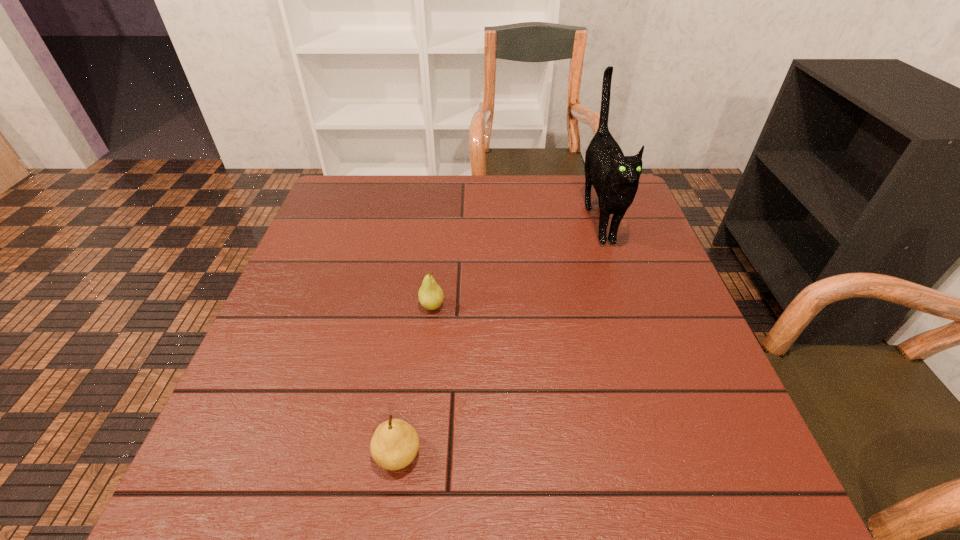
What are the coordinates of `free space in the image that satisfies the following two spatial constraints: 1. on the back side of the nearest object; 2. on the right side of the second nearest object` in the screenshot? It's located at (419, 306).

This screenshot has width=960, height=540. I want to click on free space that satisfies the following two spatial constraints: 1. on the back side of the nearest object; 2. on the left side of the second farthest object, so click(419, 306).